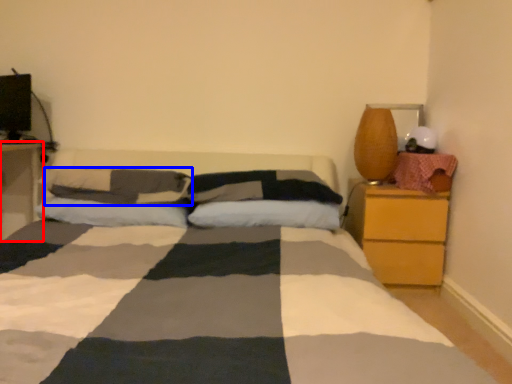
Question: Which point is closer to the camera, nightstand (highlighted by a red box) or pillow (highlighted by a blue box)?

Choices:
 (A) nightstand
 (B) pillow

Answer: (B)